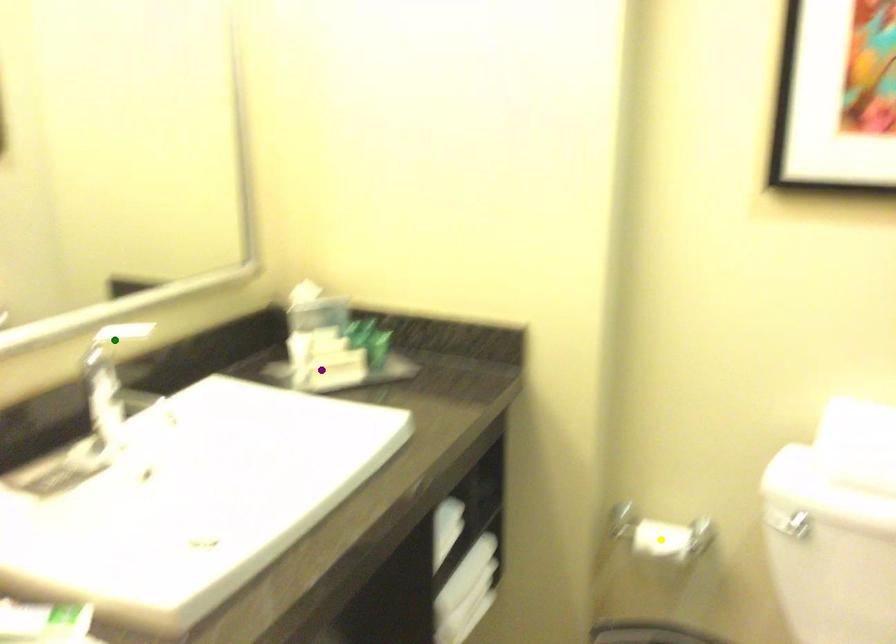
From the picture: Order these from nearest to farthest:
green point, purple point, yellow point

green point < purple point < yellow point